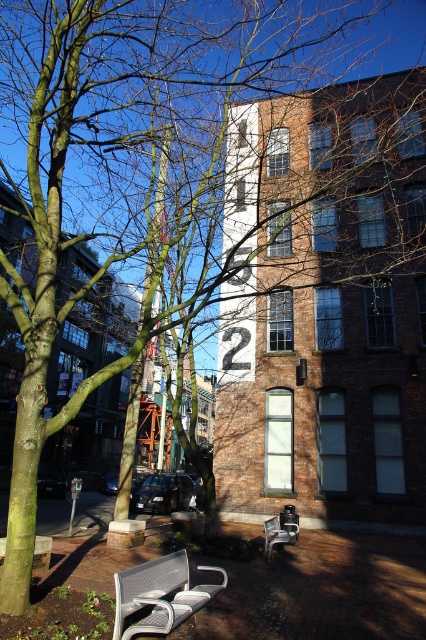
Question: Can you confirm if metallic mesh bench at lower center is positioned above metallic silver bench at lower left?

Choices:
 (A) no
 (B) yes

Answer: (B)

Question: Estimate the real-world distances between objects in this image. Which object is closer to the metallic mesh bench at lower center?

Choices:
 (A) metallic silver bench at center
 (B) metallic silver bench at lower left

Answer: (B)

Question: Is metallic mesh bench at lower center to the left of metallic silver bench at lower left from the viewer's perspective?

Choices:
 (A) no
 (B) yes

Answer: (A)

Question: Which of these objects is positioned farthest from the metallic mesh bench at lower center?

Choices:
 (A) metallic silver bench at center
 (B) metallic silver bench at lower left

Answer: (A)

Question: Based on their relative distances, which object is nearer to the metallic silver bench at center?

Choices:
 (A) metallic mesh bench at lower center
 (B) metallic silver bench at lower left

Answer: (B)

Question: Can you confirm if metallic silver bench at center is bigger than metallic silver bench at lower left?

Choices:
 (A) yes
 (B) no

Answer: (A)